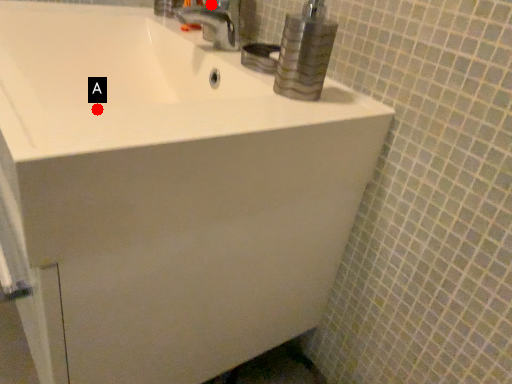
Question: Two points are circled on the image, labeled by A and B beside each circle. Which point is closer to the camera taking this photo?

Choices:
 (A) A is closer
 (B) B is closer

Answer: (A)